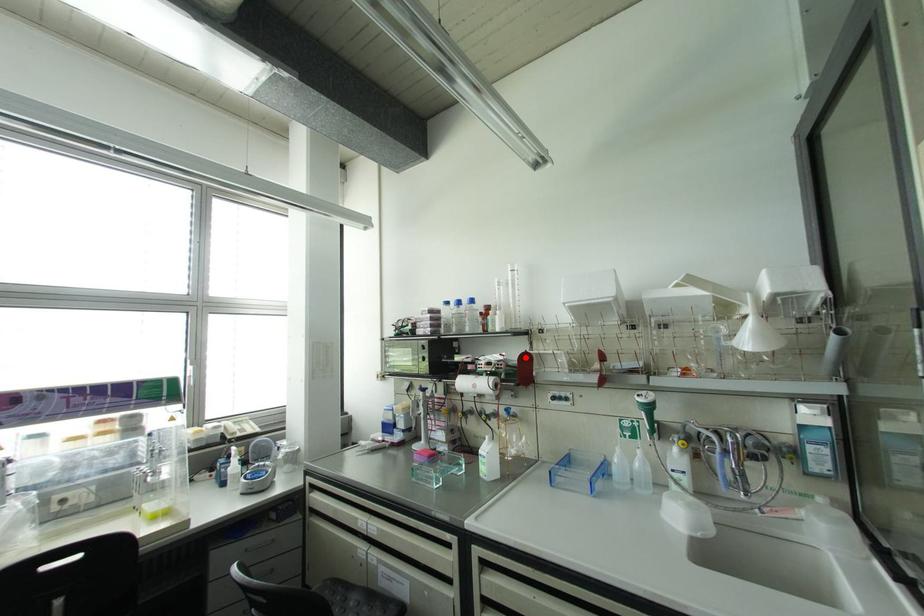
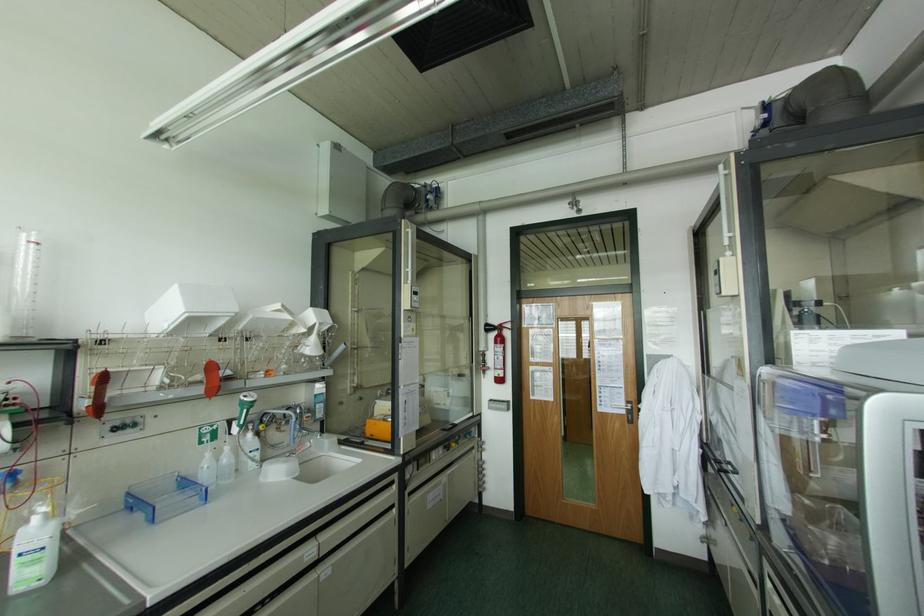
In the second image, find the point that corresponds to the highlighted location in the first image.

(102, 379)